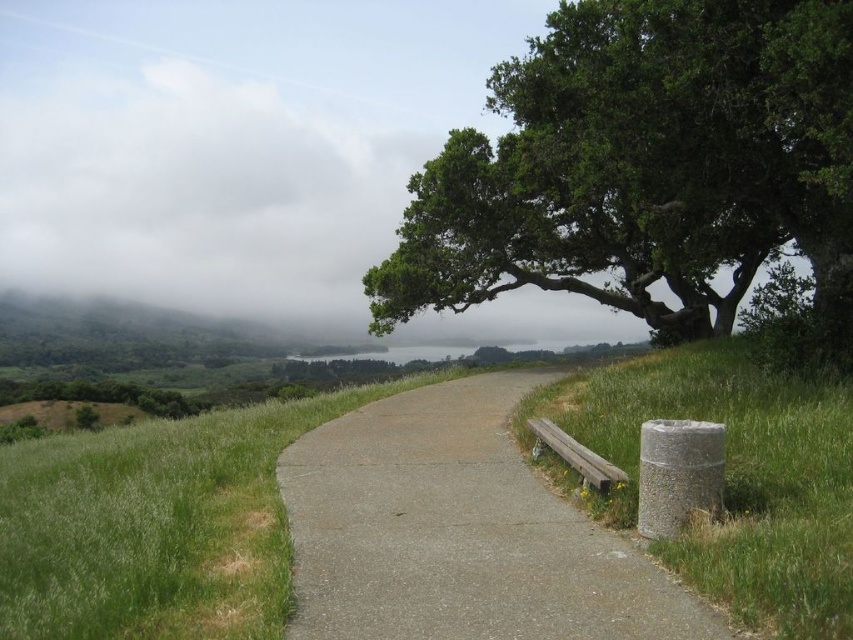
You are a hiker who wants to sit down and rest. You see the green grassy at right and the weathered wood bench at lower right. Which one is a better place to sit?

The weathered wood bench at lower right is a better place to sit because the green grassy at right is positioned over it, meaning the bench is underneath the grassy area and more suitable for sitting.

You are standing on the paved pathway and want to walk towards the green grassy at right. Which direction should you go relative to the green leafy tree at upper right?

To reach the green grassy at right, you should walk behind the green leafy tree at upper right since the green grassy at right is located behind it.